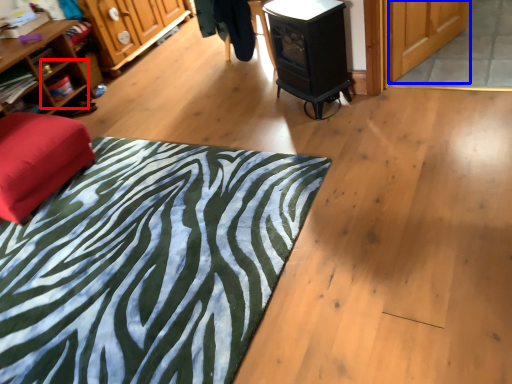
Question: Which object appears farthest to the camera in this image, shelf (highlighted by a red box) or screen door (highlighted by a blue box)?

Choices:
 (A) shelf
 (B) screen door

Answer: (A)